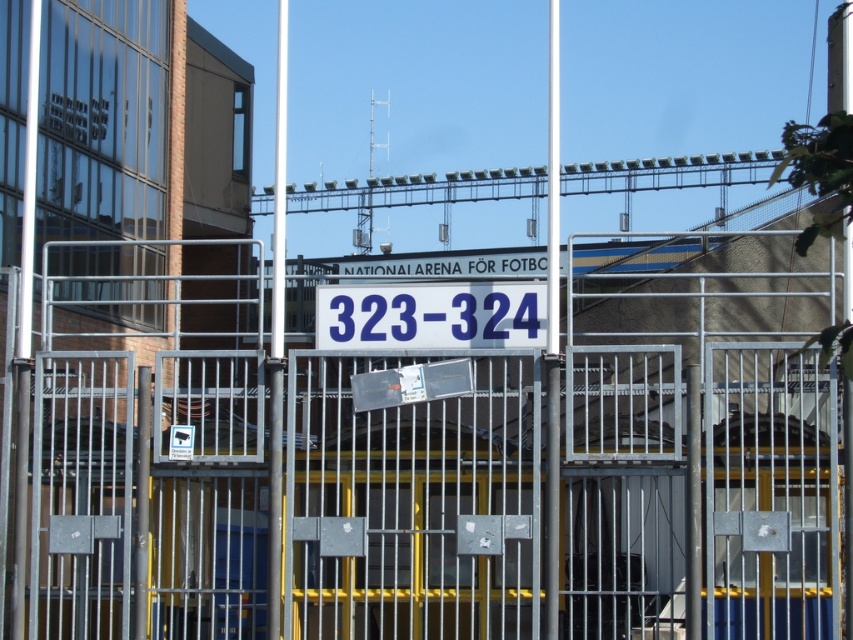
You are standing in front of a metal security gate with two points marked on it. The first point is at coordinates point (222,508) and the second point is at point (321,339). If you want to touch the point that is closer to you, which one should you choose?

You should choose point (321,339) because it is closer to you than point (222,508), which is further away.

You are a delivery person trying to enter the facility. You see the metallic gate at center and the blue plastic sign at center. Which object is closer to you?

The metallic gate at center is closer to you because it is in front of the blue plastic sign at center.